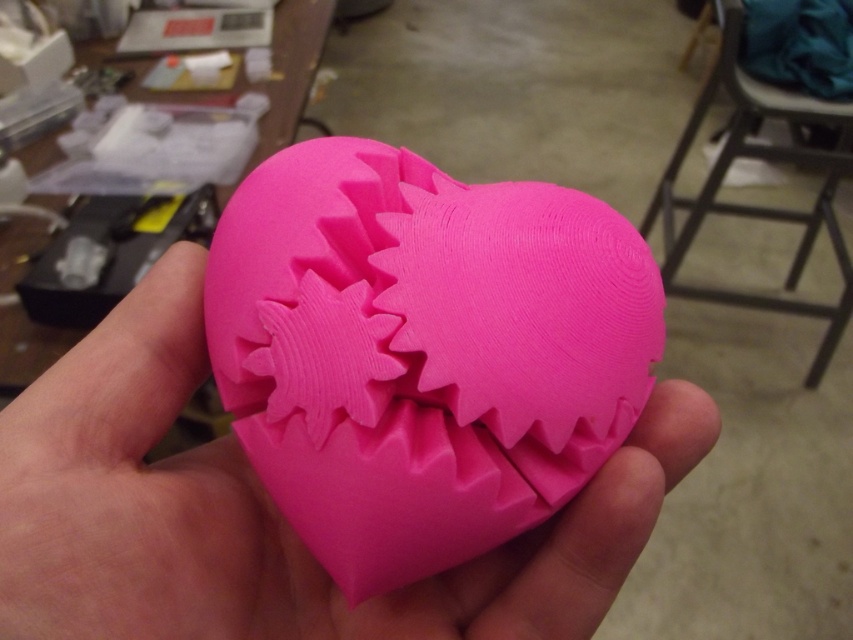
Between pink matte heart at center and metallic gray stool at upper right, which one appears on the right side from the viewer's perspective?

From the viewer's perspective, metallic gray stool at upper right appears more on the right side.

This screenshot has height=640, width=853. Find the location of `pink matte heart at center`. pink matte heart at center is located at coordinates (267, 509).

Which is behind, point (148, 365) or point (688, 241)?

The point (688, 241) is behind.

This screenshot has width=853, height=640. Find the location of `pink matte heart at center`. pink matte heart at center is located at coordinates [x=267, y=509].